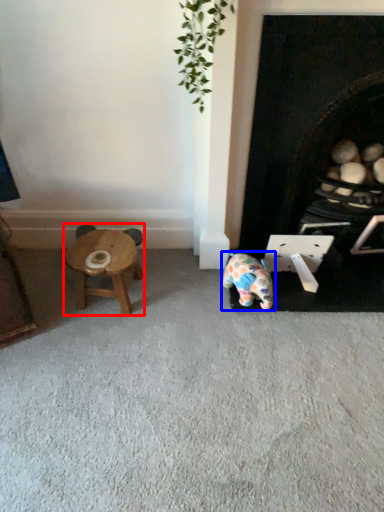
Question: Among these objects, which one is nearest to the camera, stool (highlighted by a red box) or toy (highlighted by a blue box)?

Choices:
 (A) stool
 (B) toy

Answer: (B)